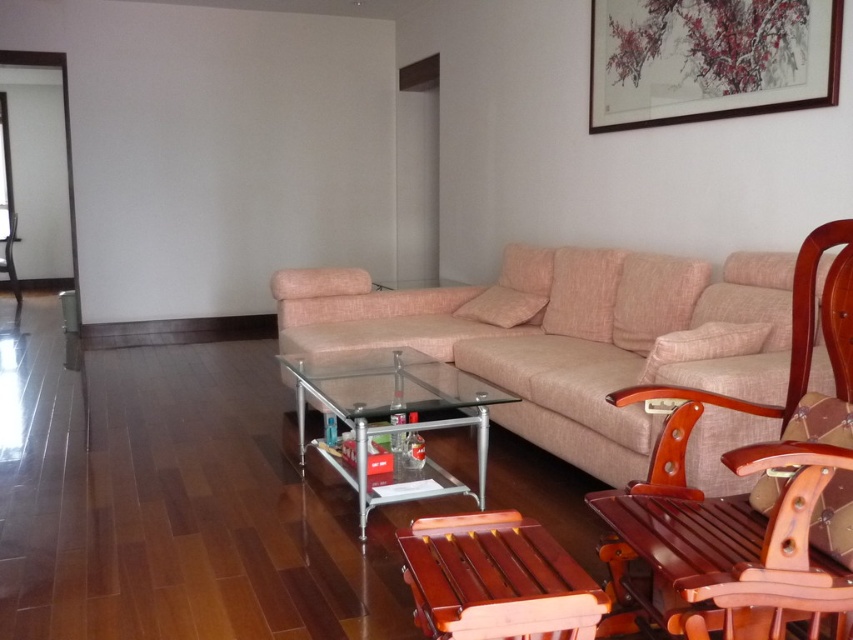
Question: Is beige fabric couch at center thinner than brown wooden chair at center?

Choices:
 (A) no
 (B) yes

Answer: (A)

Question: Which of the following is the closest to the observer?

Choices:
 (A) mahogany wood rocking chair at center
 (B) wooden picture frame at upper right
 (C) brown wooden chair at center
 (D) beige fabric couch at center

Answer: (A)

Question: Is beige fabric couch at center further to the viewer compared to mahogany wood rocking chair at center?

Choices:
 (A) yes
 (B) no

Answer: (A)

Question: Among these points, which one is farthest from the camera?

Choices:
 (A) (13, 220)
 (B) (410, 449)
 (C) (764, 93)

Answer: (A)

Question: Is beige fabric couch at center bigger than wooden picture frame at upper right?

Choices:
 (A) no
 (B) yes

Answer: (B)

Question: Estimate the real-world distances between objects in this image. Which object is closer to the transparent glass coffee table at center?

Choices:
 (A) mahogany wood rocking chair at center
 (B) beige fabric couch at center
 (C) brown wooden chair at center
 (D) wooden picture frame at upper right

Answer: (B)